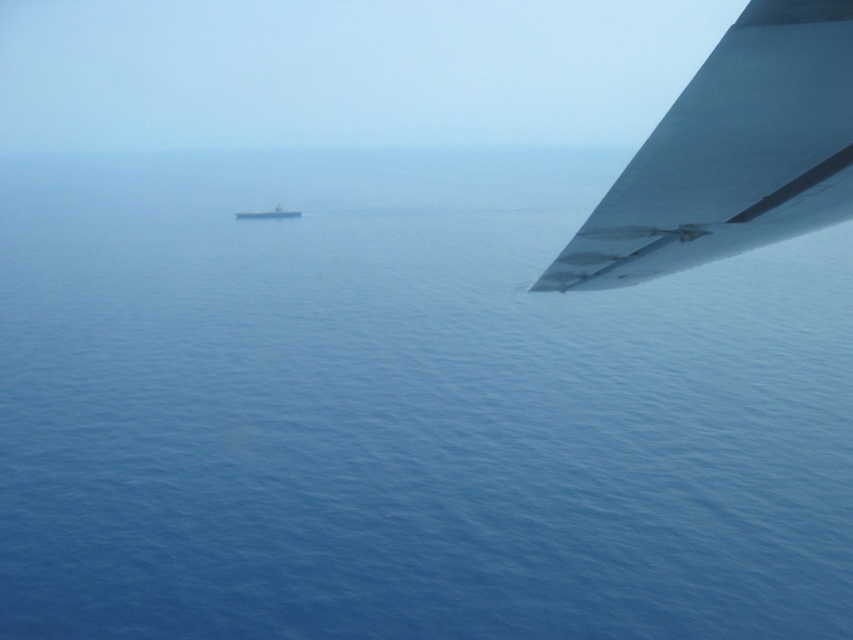
Locate an element on the screen. metallic gray winglet at upper right is located at coordinates (730, 154).

Is metallic gray winglet at upper right wider than gray metallic boat at center?

No.

Which is behind, point (718, 160) or point (268, 218)?

Point (268, 218)

Where is `metallic gray winglet at upper right`? Image resolution: width=853 pixels, height=640 pixels. metallic gray winglet at upper right is located at coordinates (730, 154).